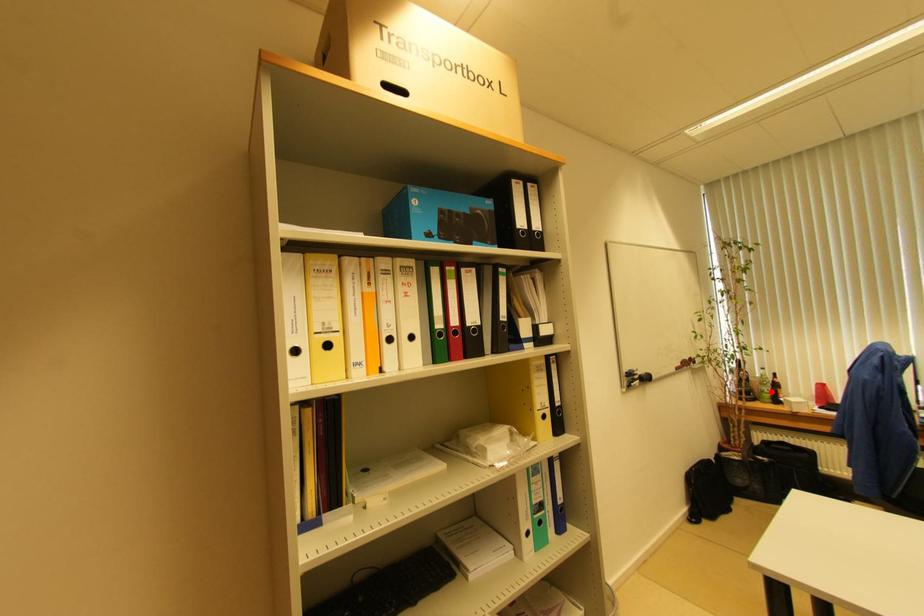
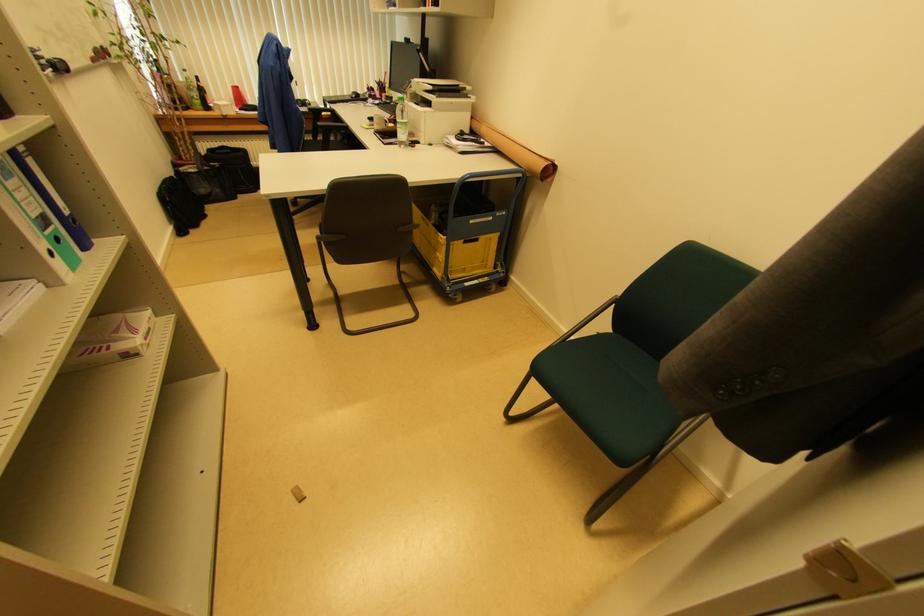
Locate, in the second image, the point that corresponds to the highlighted location in the first image.

(200, 98)